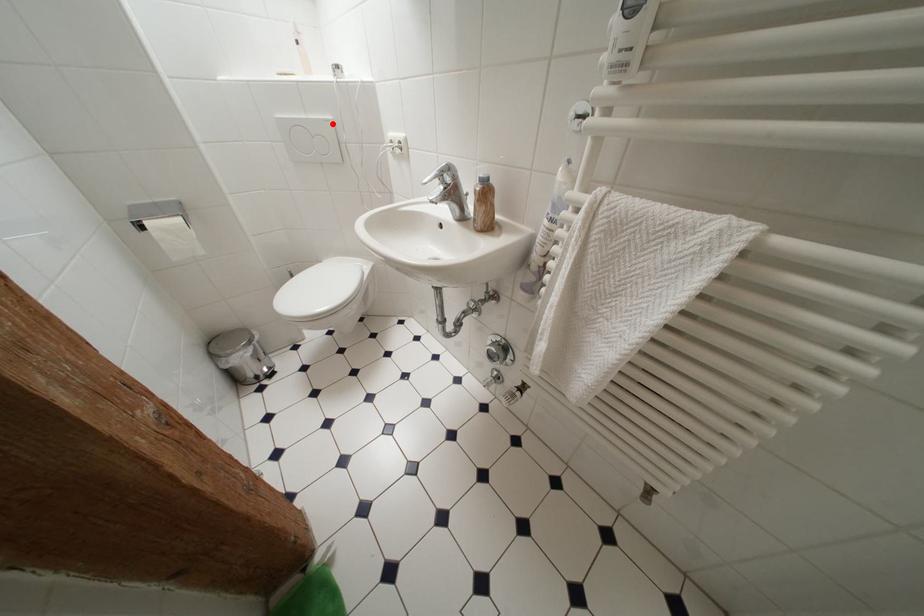
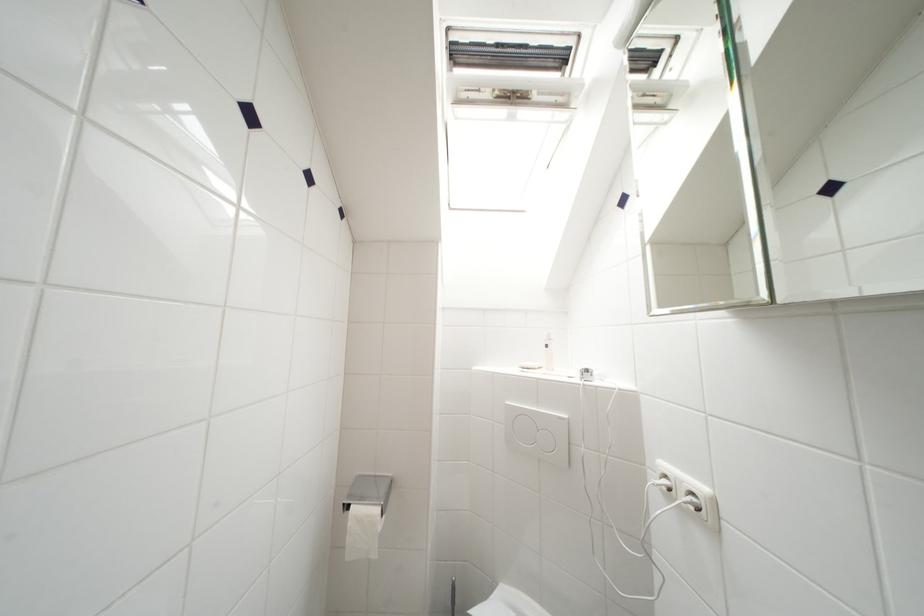
The point at the highlighted location is marked in the first image. Where is the corresponding point in the second image?

(565, 421)